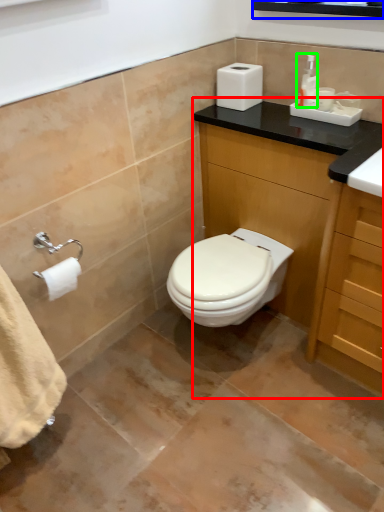
Question: Which object is positioned farthest from bathroom cabinet (highlighted by a red box)? Select from medicine cabinet (highlighted by a blue box) and toiletry (highlighted by a green box).

Choices:
 (A) medicine cabinet
 (B) toiletry

Answer: (A)